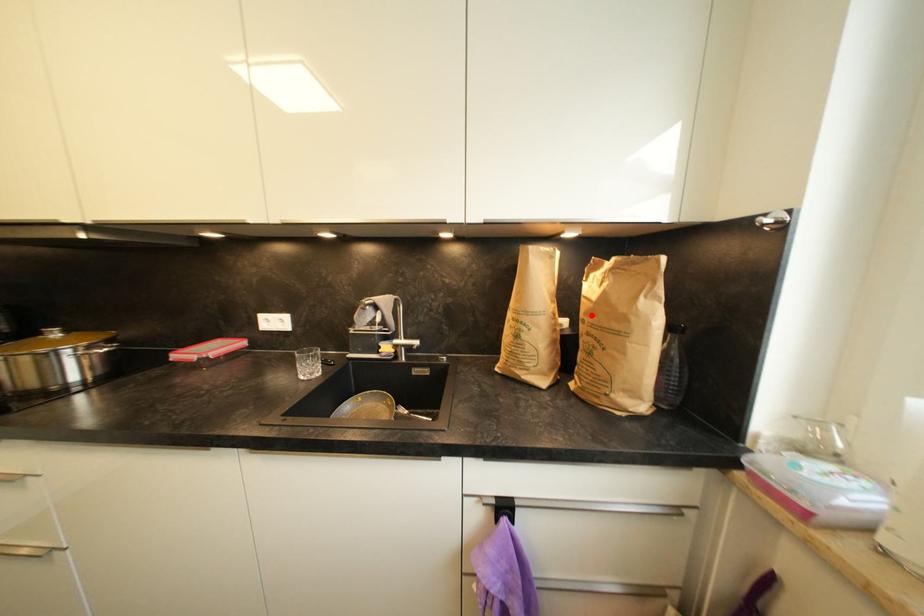
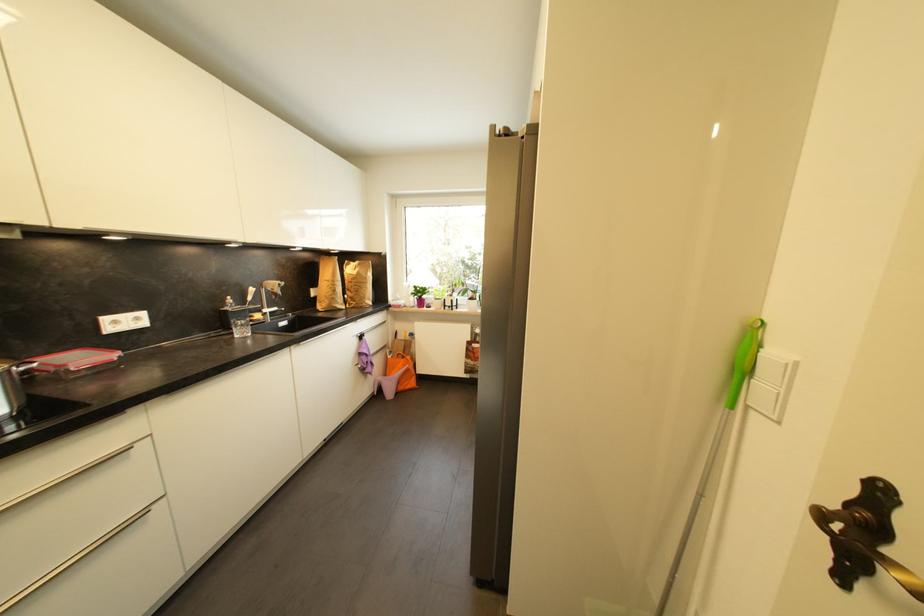
Locate, in the second image, the point that corresponds to the highlighted location in the first image.

(358, 281)